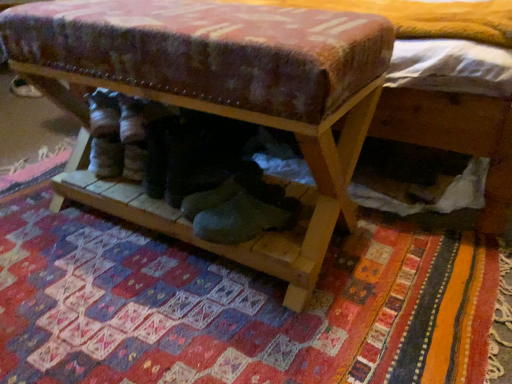
Question: From the image's perspective, would you say wooden shoe rack at center is shown under textured woolen mat at center?

Choices:
 (A) no
 (B) yes

Answer: (A)

Question: From the image's perspective, is wooden shoe rack at center on textured woolen mat at center?

Choices:
 (A) no
 (B) yes

Answer: (B)

Question: Is wooden shoe rack at center completely or partially outside of textured woolen mat at center?

Choices:
 (A) no
 (B) yes

Answer: (B)

Question: Considering the relative sizes of wooden shoe rack at center and textured woolen mat at center in the image provided, is wooden shoe rack at center thinner than textured woolen mat at center?

Choices:
 (A) yes
 (B) no

Answer: (A)

Question: Does wooden shoe rack at center have a lesser height compared to textured woolen mat at center?

Choices:
 (A) yes
 (B) no

Answer: (B)

Question: From the image's perspective, relative to wooden shoe rack at center, is white suede shoe at lower left above or below?

Choices:
 (A) below
 (B) above

Answer: (B)

Question: Choose the correct answer: Is white suede shoe at lower left inside wooden shoe rack at center or outside it?

Choices:
 (A) outside
 (B) inside

Answer: (A)

Question: Visually, is white suede shoe at lower left positioned to the left or to the right of wooden shoe rack at center?

Choices:
 (A) left
 (B) right

Answer: (A)

Question: Is white suede shoe at lower left in front of or behind wooden shoe rack at center in the image?

Choices:
 (A) behind
 (B) front

Answer: (A)

Question: In terms of height, does wooden shoe rack at center look taller or shorter compared to textured woolen mat at center?

Choices:
 (A) tall
 (B) short

Answer: (A)

Question: Considering the positions of wooden shoe rack at center and textured woolen mat at center in the image, is wooden shoe rack at center bigger or smaller than textured woolen mat at center?

Choices:
 (A) small
 (B) big

Answer: (B)

Question: From a real-world perspective, relative to textured woolen mat at center, is wooden shoe rack at center vertically above or below?

Choices:
 (A) above
 (B) below

Answer: (A)

Question: From the image's perspective, relative to textured woolen mat at center, is wooden shoe rack at center above or below?

Choices:
 (A) below
 (B) above

Answer: (B)

Question: Choose the correct answer: Is wooden shoe rack at center inside white suede shoe at lower left or outside it?

Choices:
 (A) inside
 (B) outside

Answer: (B)

Question: Is wooden shoe rack at center bigger or smaller than white suede shoe at lower left?

Choices:
 (A) small
 (B) big

Answer: (B)